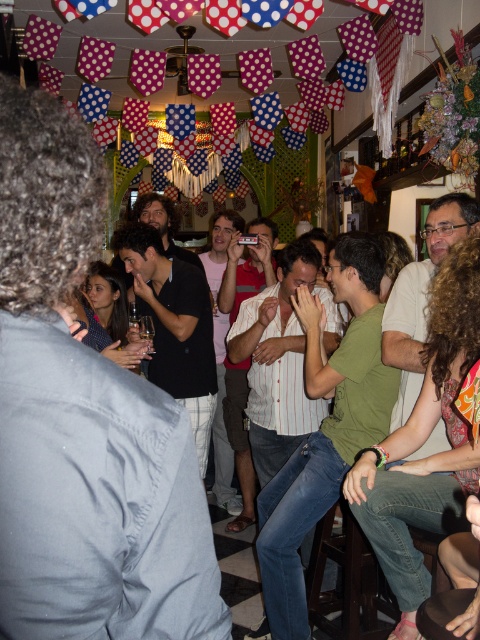
Question: Does dark blue shirt at center have a larger size compared to striped shirt at center?

Choices:
 (A) no
 (B) yes

Answer: (A)

Question: Which point is farther to the camera?

Choices:
 (A) dark blue shirt at center
 (B) white striped shirt at center
 (C) pink cotton shirt at center

Answer: (C)

Question: Is dark blue shirt at center smaller than white striped shirt at center?

Choices:
 (A) yes
 (B) no

Answer: (A)

Question: Does striped shirt at center come in front of pink cotton shirt at center?

Choices:
 (A) yes
 (B) no

Answer: (A)

Question: Based on their relative distances, which object is farther from the dark blue shirt at center?

Choices:
 (A) black matte shirt at center
 (B) matte green shirt at center
 (C) white striped shirt at center
 (D) pink cotton shirt at center

Answer: (D)

Question: Based on their relative distances, which object is farther from the dark blue shirt at center?

Choices:
 (A) white striped shirt at center
 (B) striped shirt at center
 (C) matte green shirt at center
 (D) black matte shirt at center

Answer: (B)